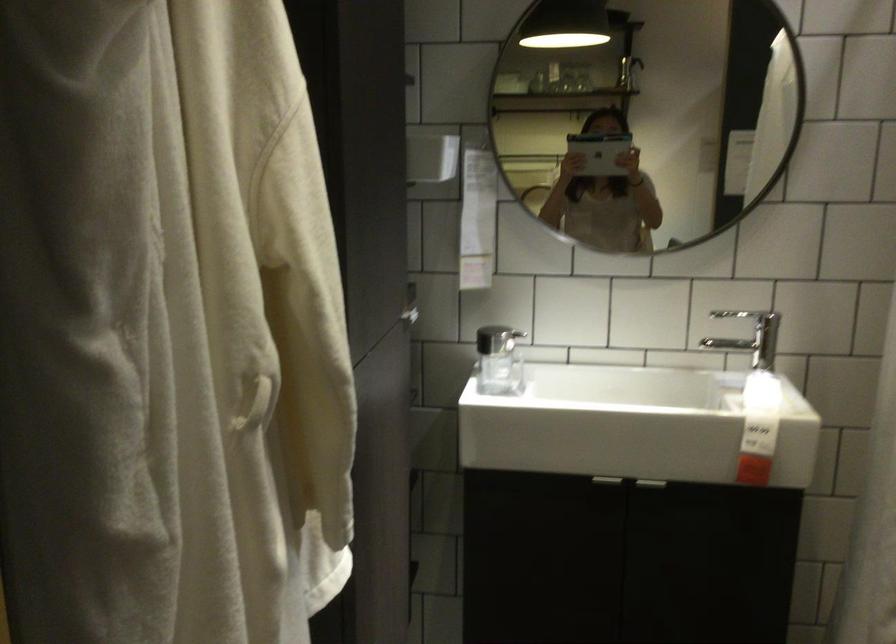
Where would you push the soap dispenser pump? Please return your answer as a coordinate pair (x, y).

(495, 339)